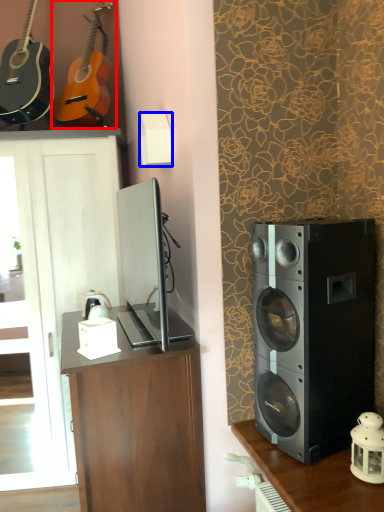
Question: Which point is closer to the camera, guitar (highlighted by a red box) or lamp (highlighted by a blue box)?

Choices:
 (A) guitar
 (B) lamp

Answer: (B)